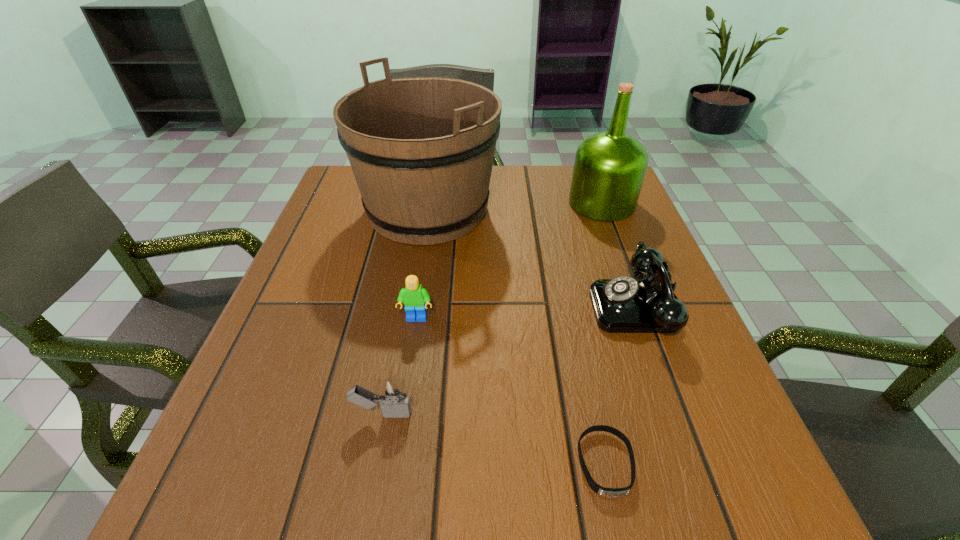
Identify the location of unoccupied position between the wristband and the Lego. This screenshot has width=960, height=540. (511, 392).

What are the coordinates of `empty space between the telephone and the Lego` in the screenshot? It's located at (527, 312).

The image size is (960, 540). I want to click on free point between the Lego and the igniter, so click(399, 366).

At what (x,y) coordinates should I click in order to perform the action: click on free spot between the olive oil and the wristband. Please return your answer as a coordinate pair (x, y). Looking at the image, I should click on (604, 334).

Identify the location of vacant space in between the Lego and the olive oil. (509, 261).

The image size is (960, 540). In order to click on free spot between the Lego and the telephone in this screenshot , I will do click(527, 312).

Locate an element on the screen. vacant space that's between the bucket and the olive oil is located at coordinates (515, 207).

Where is `free space between the fifth farthest object and the bucket`? This screenshot has height=540, width=960. free space between the fifth farthest object and the bucket is located at coordinates (405, 312).

Where is `object that can be found as the third closest to the Lego`? The image size is (960, 540). object that can be found as the third closest to the Lego is located at coordinates point(624,304).

Locate an element on the screen. Image resolution: width=960 pixels, height=540 pixels. object that stands as the second closest to the telephone is located at coordinates (609, 168).